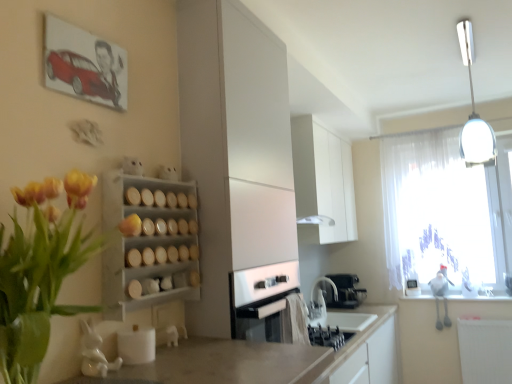
Where is `vacant area on top of white matte radiator at lower right (from a real-world perspective)`? This screenshot has height=384, width=512. vacant area on top of white matte radiator at lower right (from a real-world perspective) is located at coordinates (x=485, y=317).